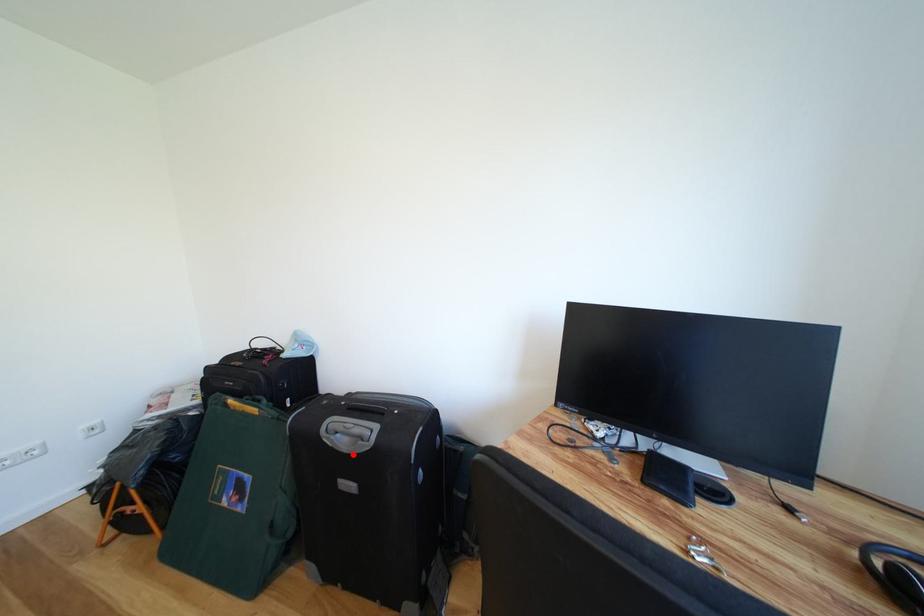
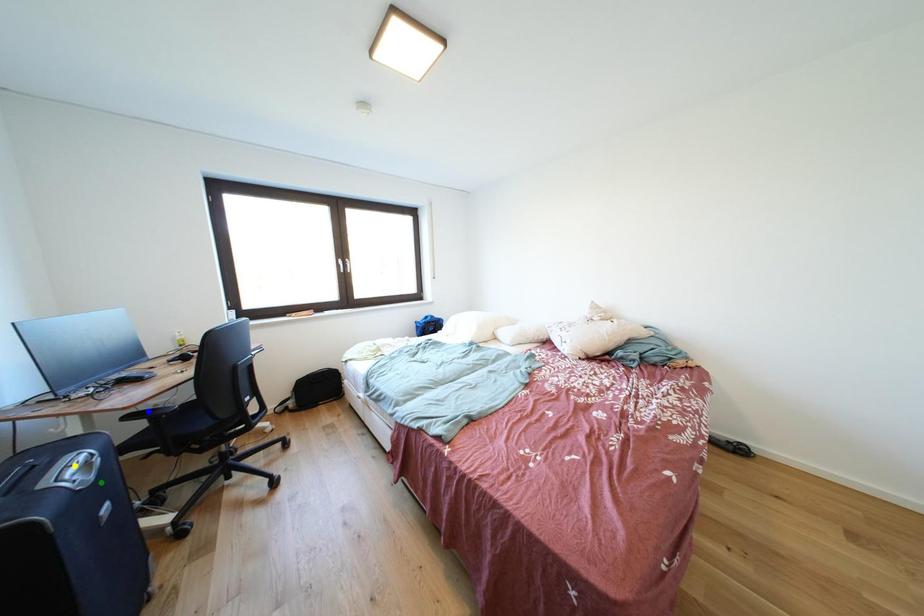
Question: I am providing you with two images of the same scene from different viewpoints. A red point is marked on the first image. You are given multiple points on the second image. In image 2, which mark is for the same physical point as the one in image 1?

Choices:
 (A) blue point
 (B) yellow point
 (C) green point

Answer: (C)